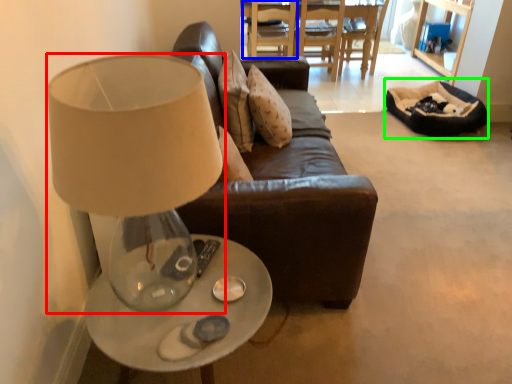
Question: Considering the real-world distances, which object is farthest from lamp (highlighted by a red box)? chair (highlighted by a blue box) or bean bag chair (highlighted by a green box)?

Choices:
 (A) chair
 (B) bean bag chair

Answer: (A)